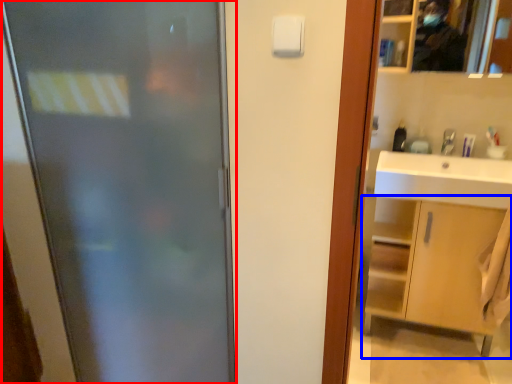
Question: Which of the following is the closest to the observer, door (highlighted by a red box) or bathroom cabinet (highlighted by a blue box)?

Choices:
 (A) door
 (B) bathroom cabinet

Answer: (A)